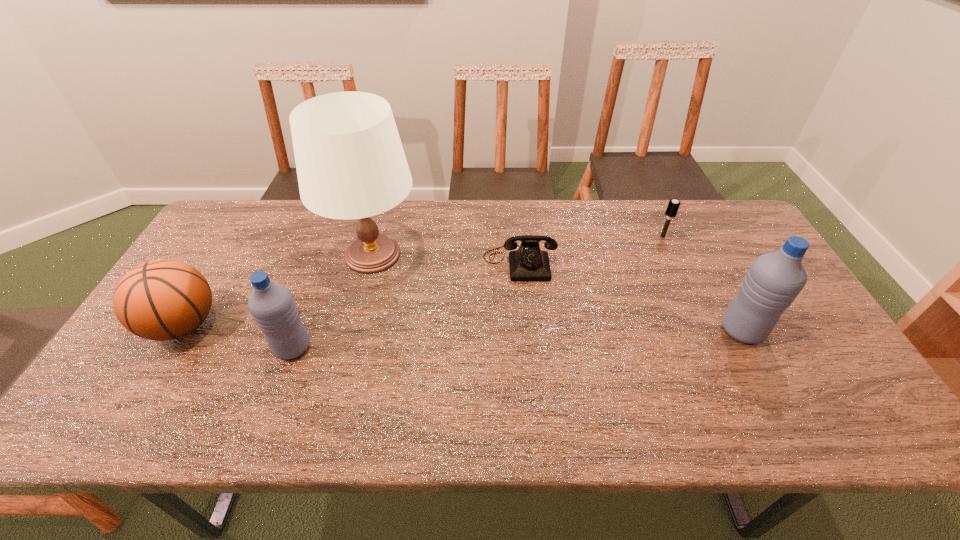
Please point a location where one more water_bottle can be added evenly. Please provide its 2D coordinates. Your answer should be formatted as a tuple, i.e. [(x, y)], where the tuple contains the x and y coordinates of a point satisfying the conditions above.

[(521, 338)]